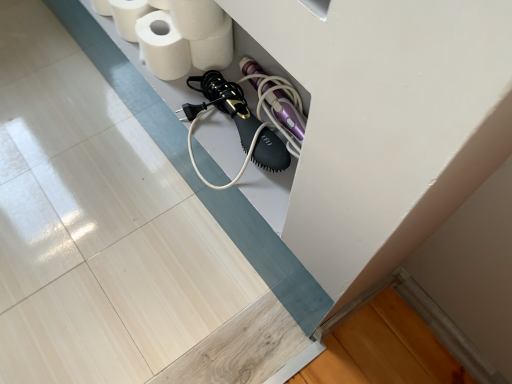
Question: Can you confirm if white matte toilet paper at upper center, which is the fourth toilet paper from left to right, is shorter than white matte toilet paper at upper center, placed as the second toilet paper when sorted from right to left?

Choices:
 (A) yes
 (B) no

Answer: (B)

Question: Is white matte toilet paper at upper center, arranged as the 1th toilet paper when viewed from the right, bigger than white matte toilet paper at upper center, placed as the second toilet paper when sorted from right to left?

Choices:
 (A) yes
 (B) no

Answer: (B)

Question: From a real-world perspective, is white matte toilet paper at upper center, which is the fourth toilet paper from left to right, on top of white matte toilet paper at upper center, which ranks as the 3th toilet paper in left-to-right order?

Choices:
 (A) no
 (B) yes

Answer: (A)

Question: Is white matte toilet paper at upper center, arranged as the 1th toilet paper when viewed from the right, positioned behind white matte toilet paper at upper center, which ranks as the 3th toilet paper in left-to-right order?

Choices:
 (A) no
 (B) yes

Answer: (B)

Question: Would you say white matte toilet paper at upper center, arranged as the 1th toilet paper when viewed from the right, is a long distance from white matte toilet paper at upper center, placed as the second toilet paper when sorted from right to left?

Choices:
 (A) no
 (B) yes

Answer: (A)

Question: Considering the positions of white matte toilet paper at upper center, placed as the second toilet paper when sorted from right to left, and white matte toilet paper at upper left, the 3th toilet paper positioned from the right, in the image, is white matte toilet paper at upper center, placed as the second toilet paper when sorted from right to left, taller or shorter than white matte toilet paper at upper left, the 3th toilet paper positioned from the right,?

Choices:
 (A) short
 (B) tall

Answer: (B)

Question: Is white matte toilet paper at upper center, which ranks as the 3th toilet paper in left-to-right order, to the left or to the right of white matte toilet paper at upper left, which ranks as the second toilet paper in left-to-right order, in the image?

Choices:
 (A) left
 (B) right

Answer: (B)

Question: Is point (176, 13) closer or farther from the camera than point (165, 46)?

Choices:
 (A) closer
 (B) farther

Answer: (A)

Question: Looking at the image, does white matte toilet paper at upper center, which ranks as the 3th toilet paper in left-to-right order, seem bigger or smaller compared to white matte toilet paper at upper left, which ranks as the second toilet paper in left-to-right order?

Choices:
 (A) big
 (B) small

Answer: (A)

Question: Based on their positions, is white matte toilet paper at upper center, which ranks as the 3th toilet paper in left-to-right order, located to the left or right of white matte toilet paper at upper left, which appears as the 4th toilet paper when viewed from the right?

Choices:
 (A) right
 (B) left

Answer: (A)

Question: Do you think white matte toilet paper at upper center, placed as the second toilet paper when sorted from right to left, is within white matte toilet paper at upper left, positioned as the 1th toilet paper in left-to-right order, or outside of it?

Choices:
 (A) inside
 (B) outside

Answer: (B)

Question: From a real-world perspective, is white matte toilet paper at upper center, placed as the second toilet paper when sorted from right to left, above or below white matte toilet paper at upper left, positioned as the 1th toilet paper in left-to-right order?

Choices:
 (A) below
 (B) above

Answer: (B)

Question: Is white matte toilet paper at upper center, placed as the second toilet paper when sorted from right to left, taller or shorter than white matte toilet paper at upper left, positioned as the 1th toilet paper in left-to-right order?

Choices:
 (A) short
 (B) tall

Answer: (B)

Question: Considering the positions of white matte toilet paper at upper center, arranged as the 1th toilet paper when viewed from the right, and white matte toilet paper at upper left, the 3th toilet paper positioned from the right, in the image, is white matte toilet paper at upper center, arranged as the 1th toilet paper when viewed from the right, wider or thinner than white matte toilet paper at upper left, the 3th toilet paper positioned from the right,?

Choices:
 (A) thin
 (B) wide

Answer: (A)

Question: Based on their positions, is white matte toilet paper at upper center, arranged as the 1th toilet paper when viewed from the right, located to the left or right of white matte toilet paper at upper left, which ranks as the second toilet paper in left-to-right order?

Choices:
 (A) left
 (B) right

Answer: (B)